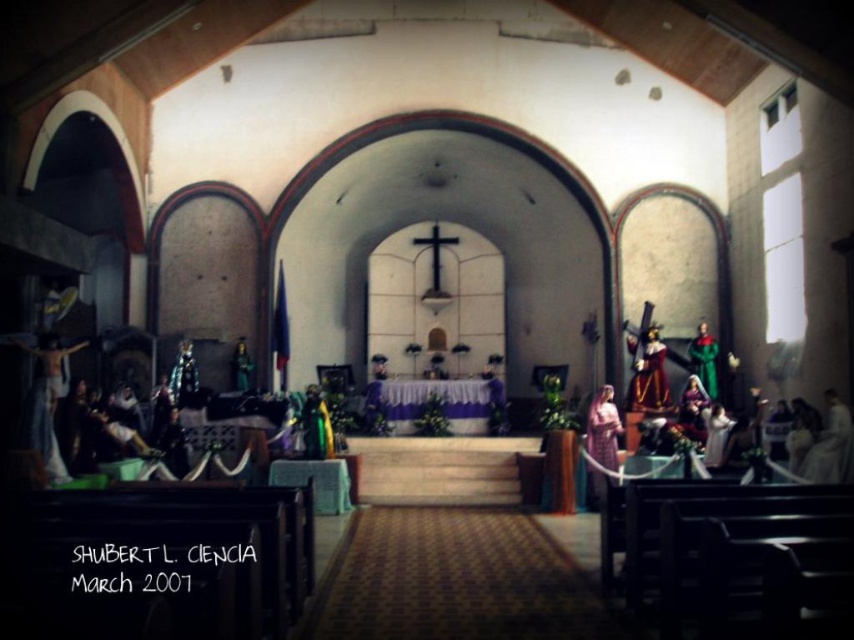
Which is above, wooden statue at right or matte pink fabric at center?

wooden statue at right is higher up.

Measure the distance between point (642, 380) and camera.

They are 18.38 meters apart.

Where is `wooden statue at right`? wooden statue at right is located at coordinates (648, 372).

Is matte pink fabric at center below green fabric figure at right?

Yes.

Is matte pink fabric at center shorter than green fabric figure at right?

Yes.

Does point (600, 458) lie behind point (711, 346)?

No, (600, 458) is closer to viewer.

What are the coordinates of `matte pink fabric at center` in the screenshot? It's located at (603, 428).

Between matte wooden crucifix at left and matte pink fabric at center, which one appears on the right side from the viewer's perspective?

Positioned to the right is matte pink fabric at center.

Looking at this image, can you confirm if matte wooden crucifix at left is positioned below matte pink fabric at center?

No, matte wooden crucifix at left is not below matte pink fabric at center.

Based on the photo, measure the distance between matte wooden crucifix at left and camera.

The distance of matte wooden crucifix at left from camera is 12.67 meters.

I want to click on matte wooden crucifix at left, so click(47, 401).